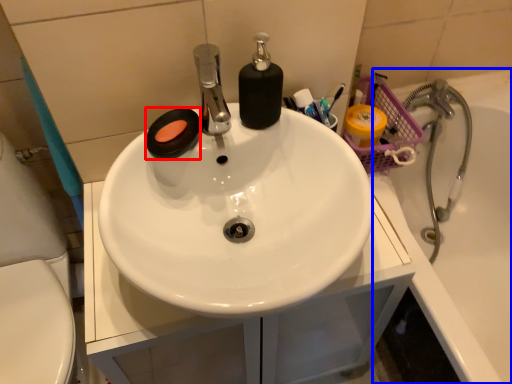
Question: Which of the following is the closest to the observer, soap (highlighted by a red box) or bath (highlighted by a blue box)?

Choices:
 (A) soap
 (B) bath

Answer: (A)